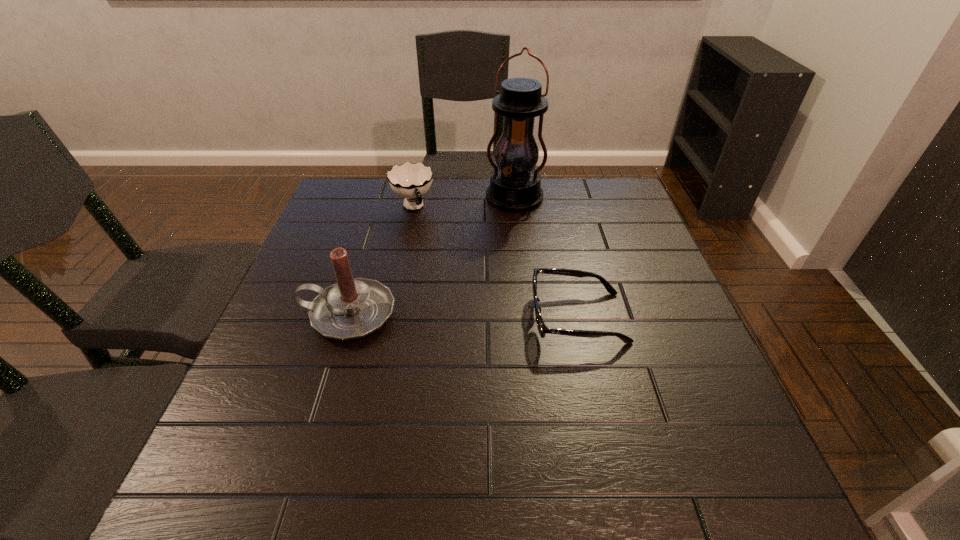
I want to click on blank area located on the side of the third tallest object with the handle, so click(460, 298).

Identify a few spots in free region located 0.310m above the lantern, indicating its light source. Please provide its 2D coordinates. Your answer should be formatted as a tuple, i.e. [(x, y)], where the tuple contains the x and y coordinates of a point satisfying the conditions above.

[(492, 288)]

Locate some placea in vacant space located above the lantern, indicating its light source. Please provide its 2D coordinates. Your answer should be formatted as a tuple, i.e. [(x, y)], where the tuple contains the x and y coordinates of a point satisfying the conditions above.

[(490, 297)]

Identify some points in free space located 0.180m above the lantern, indicating its light source. Please provide its 2D coordinates. Your answer should be formatted as a tuple, i.e. [(x, y)], where the tuple contains the x and y coordinates of a point satisfying the conditions above.

[(500, 254)]

Find the location of a particular element. cup that is at the far edge is located at coordinates [411, 181].

Identify the location of lantern present at the far edge. click(x=515, y=185).

The image size is (960, 540). What are the coordinates of `object that is at the left edge` in the screenshot? It's located at click(352, 308).

The height and width of the screenshot is (540, 960). I want to click on object that is at the right edge, so click(542, 328).

At what (x,y) coordinates should I click in order to perform the action: click on free space at the far edge of the desktop. Please return your answer as a coordinate pair (x, y). Image resolution: width=960 pixels, height=540 pixels. Looking at the image, I should click on (480, 184).

In the image, there is a desktop. Where is `free space at the left edge`? This screenshot has height=540, width=960. free space at the left edge is located at coordinates point(276,387).